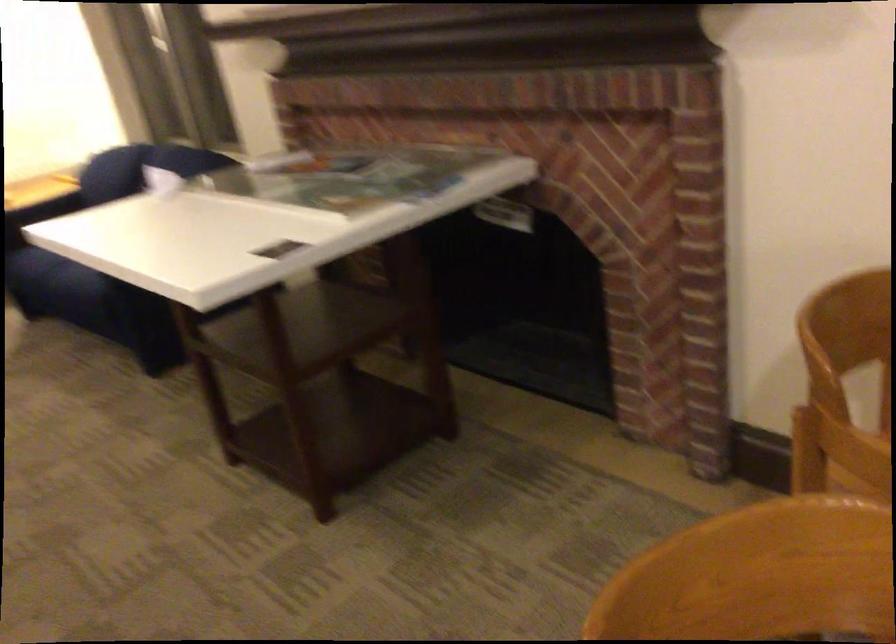
Locate an element on the screen. The height and width of the screenshot is (644, 896). sofa armrest is located at coordinates (56, 281).